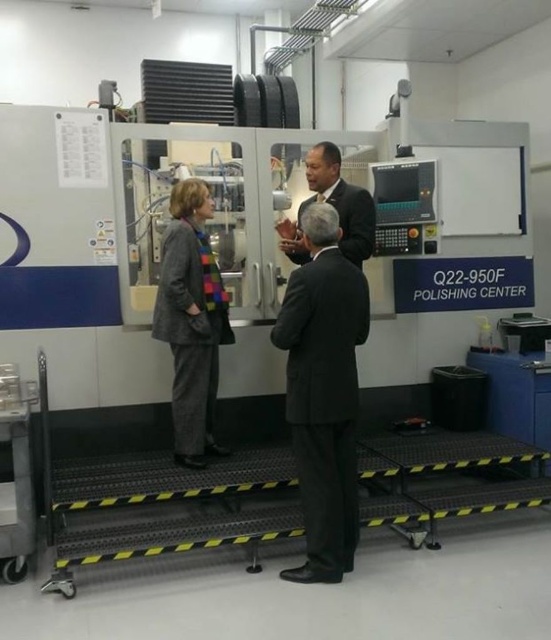
Question: Does gray woolen blazer at center have a larger size compared to dark suit at center?

Choices:
 (A) no
 (B) yes

Answer: (B)

Question: Is gray woolen blazer at center further to camera compared to dark suit at center?

Choices:
 (A) yes
 (B) no

Answer: (B)

Question: Is black suit at center below dark suit at center?

Choices:
 (A) yes
 (B) no

Answer: (A)

Question: Estimate the real-world distances between objects in this image. Which object is farther from the black suit at center?

Choices:
 (A) gray woolen blazer at center
 (B) dark suit at center

Answer: (A)

Question: Estimate the real-world distances between objects in this image. Which object is closer to the gray woolen blazer at center?

Choices:
 (A) black suit at center
 (B) dark suit at center

Answer: (B)

Question: Among these objects, which one is nearest to the camera?

Choices:
 (A) black suit at center
 (B) dark suit at center

Answer: (A)